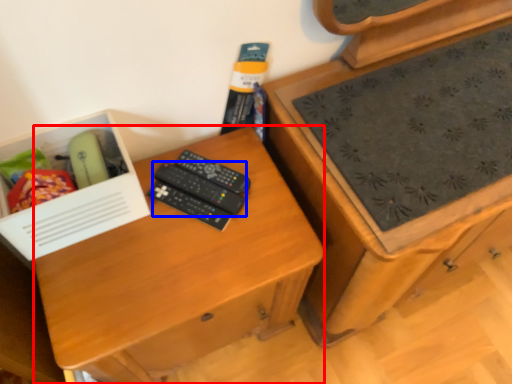
Question: Among these objects, which one is nearest to the camera, desk (highlighted by a red box) or remote control (highlighted by a blue box)?

Choices:
 (A) desk
 (B) remote control

Answer: (A)